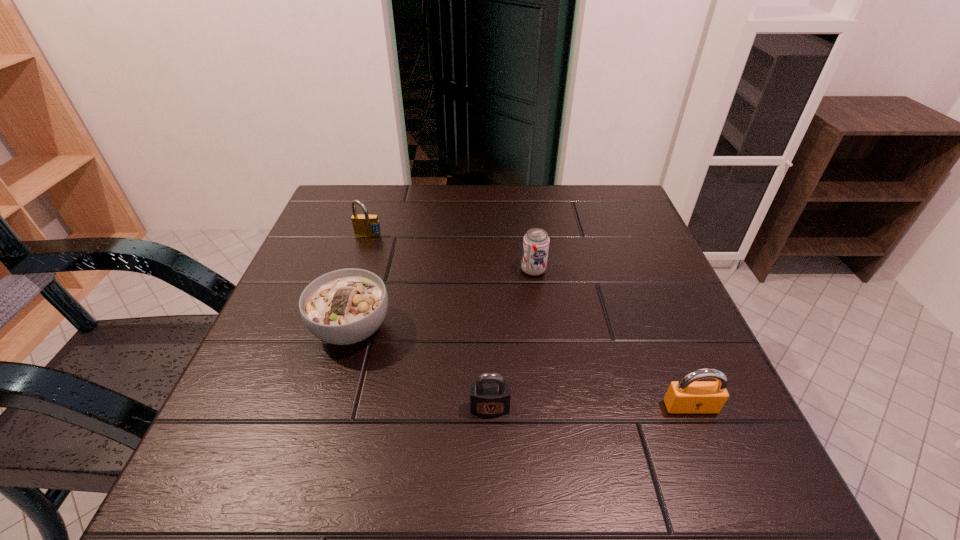
Find the location of a particular element. The height and width of the screenshot is (540, 960). free location located 0.260m on the right of the soup bowl is located at coordinates coord(524,328).

Find the location of a particular element. The height and width of the screenshot is (540, 960). free space located on the front of the second padlock from left to right near the keyhole is located at coordinates (491, 446).

This screenshot has height=540, width=960. Identify the location of object that is at the far edge. (364, 225).

This screenshot has height=540, width=960. Identify the location of padlock located at the left edge. (364, 225).

The height and width of the screenshot is (540, 960). Identify the location of soup bowl located at the left edge. (346, 306).

What are the coordinates of `object located in the right edge section of the desktop` in the screenshot? It's located at (687, 395).

This screenshot has width=960, height=540. I want to click on object present at the far left corner, so click(x=364, y=225).

In the image, there is a desktop. Find the location of `free space at the far edge`. free space at the far edge is located at coordinates (405, 192).

Where is `free space at the near edge of the desktop`? free space at the near edge of the desktop is located at coordinates tap(309, 487).

I want to click on vacant space at the left edge, so 299,305.